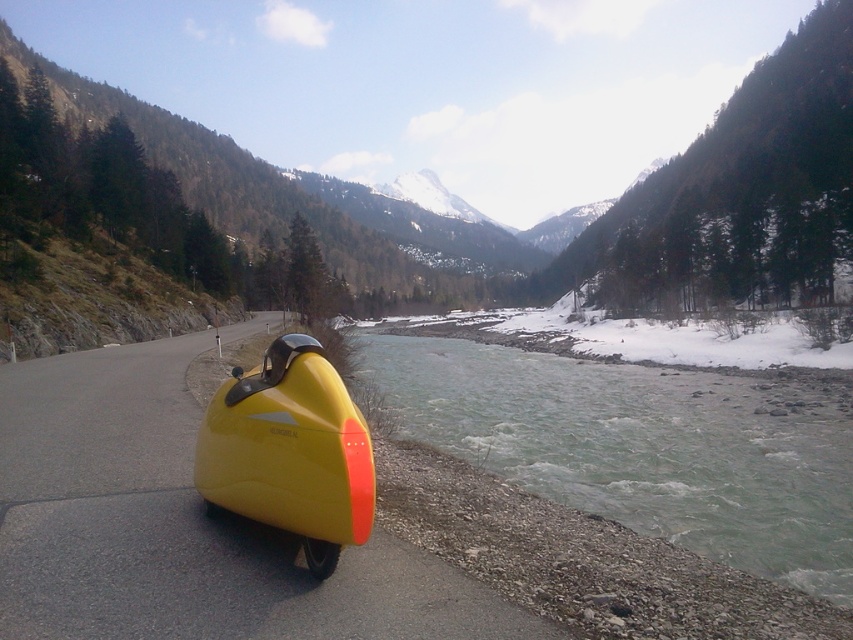
Question: Which of the following is the closest to the observer?

Choices:
 (A) greenish-gray water at lower center
 (B) yellow matte sidecar at left

Answer: (B)

Question: Can you confirm if greenish-gray water at lower center is wider than yellow matte sidecar at left?

Choices:
 (A) no
 (B) yes

Answer: (B)

Question: Is greenish-gray water at lower center above yellow matte sidecar at left?

Choices:
 (A) yes
 (B) no

Answer: (B)

Question: Among these points, which one is farthest from the camera?

Choices:
 (A) (260, 378)
 (B) (840, 412)

Answer: (B)

Question: Can you confirm if greenish-gray water at lower center is positioned below yellow matte sidecar at left?

Choices:
 (A) yes
 (B) no

Answer: (A)